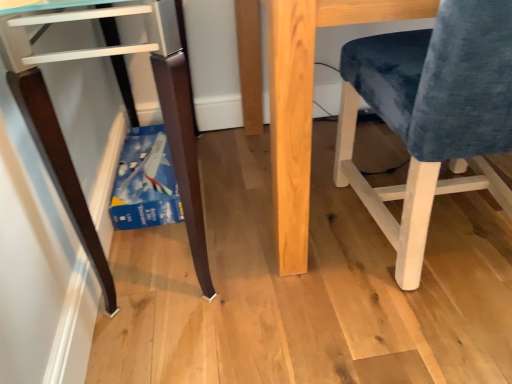
Question: Are natural wood table at center and matte dark wood desk at lower left far apart?

Choices:
 (A) no
 (B) yes

Answer: (A)

Question: Can you confirm if natural wood table at center is positioned to the right of matte dark wood desk at lower left?

Choices:
 (A) no
 (B) yes

Answer: (B)

Question: Is natural wood table at center to the left of matte dark wood desk at lower left from the viewer's perspective?

Choices:
 (A) no
 (B) yes

Answer: (A)

Question: Is natural wood table at center looking in the opposite direction of matte dark wood desk at lower left?

Choices:
 (A) yes
 (B) no

Answer: (B)

Question: Does natural wood table at center have a greater width compared to matte dark wood desk at lower left?

Choices:
 (A) yes
 (B) no

Answer: (A)

Question: From a real-world perspective, is velvet blue chair at right physically located above or below natural wood table at center?

Choices:
 (A) above
 (B) below

Answer: (A)

Question: Is velvet blue chair at right to the left or to the right of natural wood table at center in the image?

Choices:
 (A) left
 (B) right

Answer: (B)

Question: Is velvet blue chair at right bigger or smaller than natural wood table at center?

Choices:
 (A) big
 (B) small

Answer: (B)

Question: Considering the positions of point (413, 213) and point (410, 16), is point (413, 213) closer or farther from the camera than point (410, 16)?

Choices:
 (A) farther
 (B) closer

Answer: (A)

Question: Is matte dark wood desk at lower left wider or thinner than natural wood table at center?

Choices:
 (A) wide
 (B) thin

Answer: (B)

Question: Considering their positions, is matte dark wood desk at lower left located in front of or behind natural wood table at center?

Choices:
 (A) front
 (B) behind

Answer: (A)

Question: From the image's perspective, is matte dark wood desk at lower left positioned above or below natural wood table at center?

Choices:
 (A) below
 (B) above

Answer: (A)

Question: From a real-world perspective, relative to natural wood table at center, is matte dark wood desk at lower left vertically above or below?

Choices:
 (A) below
 (B) above

Answer: (B)

Question: Is natural wood table at center wider or thinner than velvet blue chair at right?

Choices:
 (A) wide
 (B) thin

Answer: (A)

Question: Is natural wood table at center in front of or behind velvet blue chair at right in the image?

Choices:
 (A) behind
 (B) front

Answer: (A)